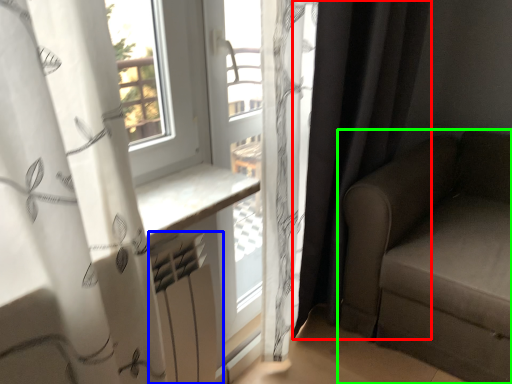
Question: Considering the real-world distances, which object is farthest from curtain (highlighted by a red box)? radiator (highlighted by a blue box) or studio couch (highlighted by a green box)?

Choices:
 (A) radiator
 (B) studio couch

Answer: (A)